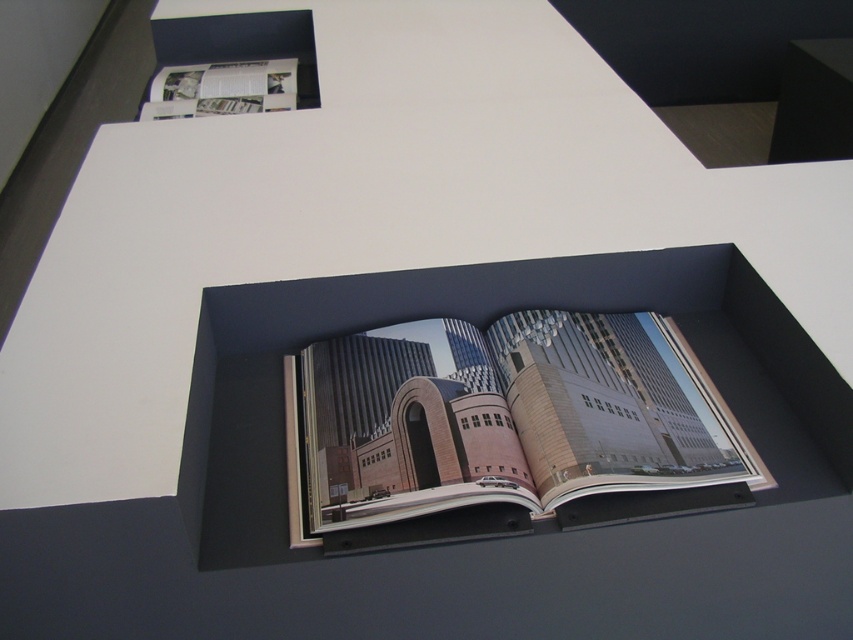
Question: Among these objects, which one is farthest from the camera?

Choices:
 (A) white glossy magazine at upper left
 (B) matte paper book at center

Answer: (A)

Question: Can you confirm if matte paper book at center is positioned to the right of white glossy magazine at upper left?

Choices:
 (A) yes
 (B) no

Answer: (A)

Question: Which point is farther from the camera taking this photo?

Choices:
 (A) (216, 92)
 (B) (321, 516)

Answer: (A)

Question: Is matte paper book at center to the left of white glossy magazine at upper left from the viewer's perspective?

Choices:
 (A) yes
 (B) no

Answer: (B)

Question: Is the position of matte paper book at center less distant than that of white glossy magazine at upper left?

Choices:
 (A) no
 (B) yes

Answer: (B)